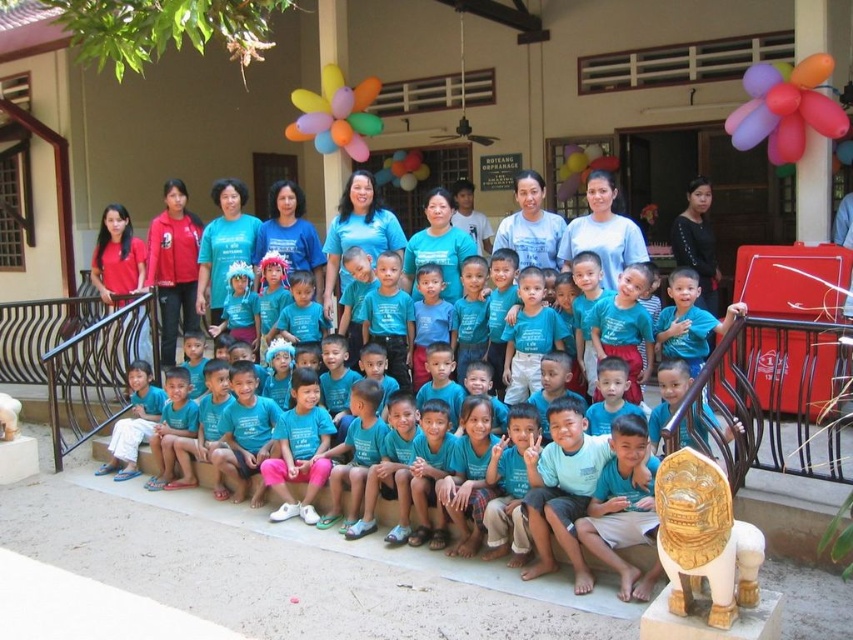
You are a photographer trying to focus on two points in the image. The first point is at coordinates point (779, 125) and the second is at point (347, 136). Which point should you adjust your camera focus to if you want to capture the one that is closer to the camera?

The point at (779, 125) is closer to the camera than point (347, 136), so you should adjust your camera focus to that point.

You are planning to take a photo of the group, and you want to ensure the multicolored glossy balloon at upper right and the translucent multicolored balloons at center are both visible. Which balloon group should you focus on to avoid them overlapping with the children?

The multicolored glossy balloon at upper right has a lesser width compared to the translucent multicolored balloons at center, so focusing on the translucent multicolored balloons at center would be better to avoid overlapping with the children since they are larger and might require more space in the frame.

You are a photographer trying to capture a clear shot of the multicolored glossy balloon at upper right and the translucent multicolored balloons at center. Based on their positions, which balloon group is closer to the camera?

The multicolored glossy balloon at upper right is closer to the camera because it is in front of the translucent multicolored balloons at center.